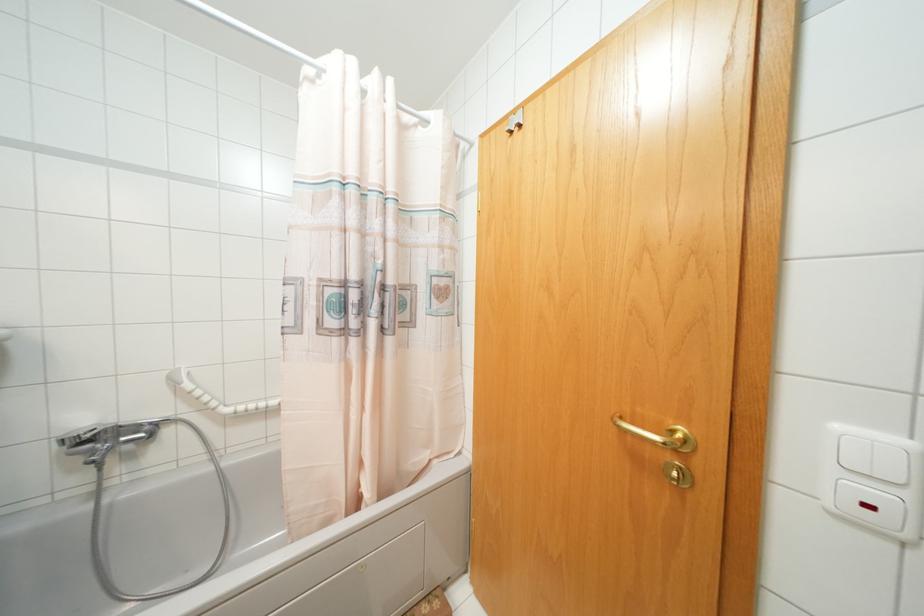
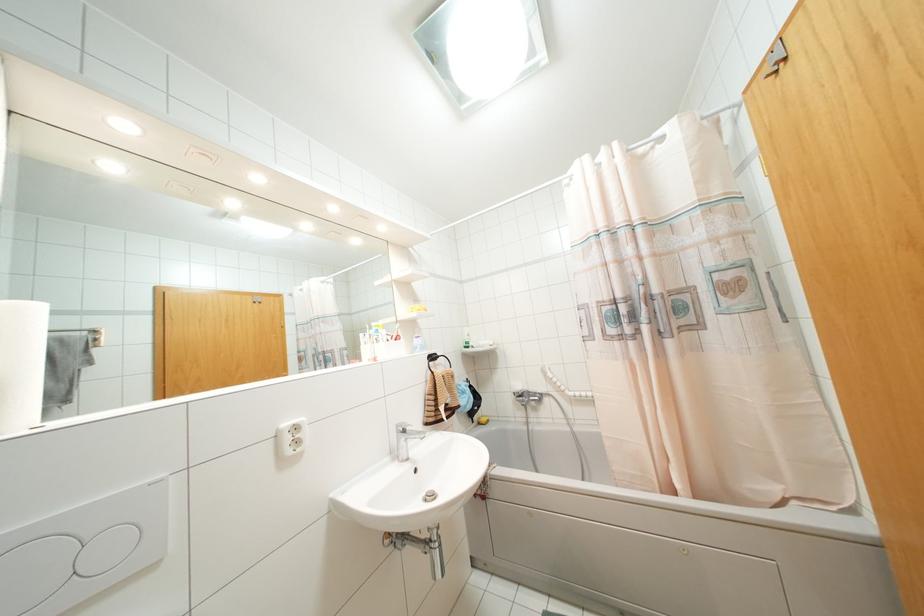
Locate, in the second image, the point that corresponds to [511,132] in the first image.

(775, 71)